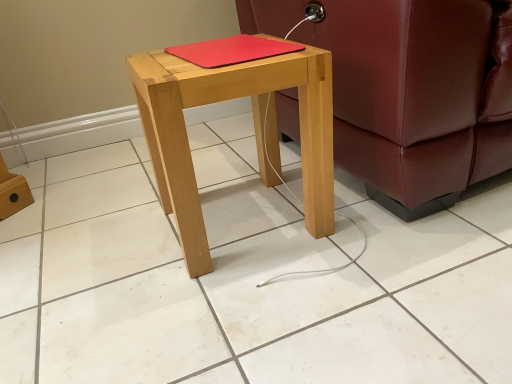
Where is `free space in front of natural wood stool at center`? The width and height of the screenshot is (512, 384). free space in front of natural wood stool at center is located at coordinates (252, 310).